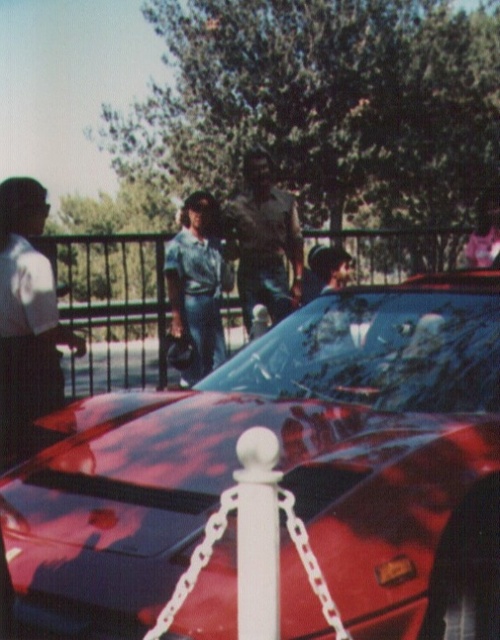
Question: Which object is positioned farthest from the denim jeans at center?

Choices:
 (A) white glossy pole at center
 (B) white shirt at left
 (C) shiny red car at center

Answer: (A)

Question: Is white shirt at left thinner than brown leather jacket at center?

Choices:
 (A) yes
 (B) no

Answer: (A)

Question: Is shiny red car at center bigger than white glossy pole at center?

Choices:
 (A) yes
 (B) no

Answer: (A)

Question: Can you confirm if shiny red car at center is positioned above white glossy pole at center?

Choices:
 (A) no
 (B) yes

Answer: (B)

Question: Considering the real-world distances, which object is closest to the clear glass windshield at center?

Choices:
 (A) white glossy pole at center
 (B) shiny red car at center
 (C) brown leather jacket at center
 (D) white shirt at left

Answer: (B)

Question: Based on their relative distances, which object is nearer to the clear glass windshield at center?

Choices:
 (A) denim jeans at center
 (B) white glossy pole at center

Answer: (B)